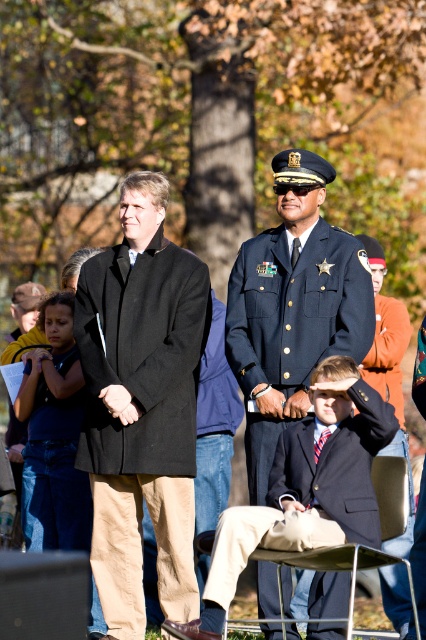
Question: Can you confirm if light blue fabric uniform at center is positioned below dark blue denim shirt at left?

Choices:
 (A) no
 (B) yes

Answer: (A)

Question: Can you confirm if black wool coat at center is positioned below dark blue suit at center?

Choices:
 (A) yes
 (B) no

Answer: (B)

Question: Which object is the farthest from the dark blue suit at center?

Choices:
 (A) black wool coat at center
 (B) dark blue denim shirt at left
 (C) light blue fabric uniform at center

Answer: (B)

Question: Can you confirm if black wool coat at center is wider than dark blue suit at center?

Choices:
 (A) yes
 (B) no

Answer: (B)

Question: Which object is positioned closest to the dark blue denim shirt at left?

Choices:
 (A) black wool coat at center
 (B) light blue fabric uniform at center

Answer: (A)

Question: Which object appears closest to the camera in this image?

Choices:
 (A) light blue fabric uniform at center
 (B) black wool coat at center
 (C) dark blue suit at center

Answer: (C)